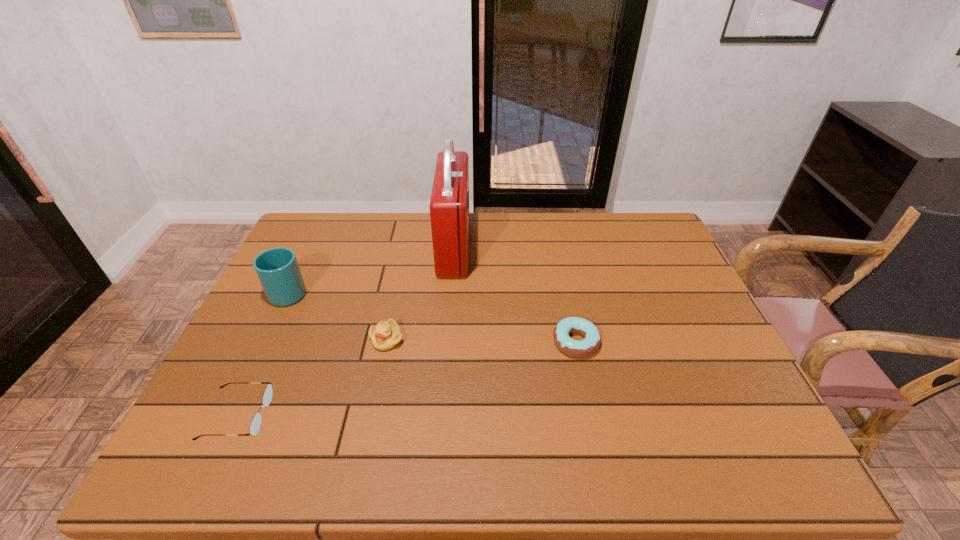
I want to click on vacant area that lies between the doughnut and the spectacles, so click(x=407, y=379).

At what (x,y) coordinates should I click in order to perform the action: click on vacant space that's between the doughnut and the fourth shortest object. Please return your answer as a coordinate pair (x, y). The height and width of the screenshot is (540, 960). Looking at the image, I should click on (433, 316).

You are a GUI agent. You are given a task and a screenshot of the screen. Output one action in this format:
    pyautogui.click(x=<x>, y=<y>)
    Task: Click on the vacant space in between the second tallest object and the spectacles
    This screenshot has width=960, height=540.
    Given the screenshot: What is the action you would take?
    pyautogui.click(x=264, y=353)

The image size is (960, 540). Find the location of `the second closest object to the third shortest object`. the second closest object to the third shortest object is located at coordinates (255, 424).

You are a GUI agent. You are given a task and a screenshot of the screen. Output one action in this format:
    pyautogui.click(x=<x>, y=<y>)
    Task: Click on the object that is the closest to the spectacles
    The height and width of the screenshot is (540, 960).
    Given the screenshot: What is the action you would take?
    pyautogui.click(x=386, y=335)

The image size is (960, 540). Identify the location of vacant position in the image that satisfies the following two spatial constraints: 1. at the face of the duckling; 2. on the lenses of the spectacles. (371, 415).

The height and width of the screenshot is (540, 960). What are the coordinates of `vacant space that satisfies the following two spatial constraints: 1. on the front face of the second object from right to left; 2. on the back side of the rightmost object` in the screenshot? It's located at click(446, 342).

The width and height of the screenshot is (960, 540). I want to click on vacant region that satisfies the following two spatial constraints: 1. on the front face of the first-aid kit; 2. at the face of the duckling, so click(447, 339).

Where is `vacant point that satisfies the following two spatial constraints: 1. on the front face of the tallest object; 2. on the left side of the rightmost object`? vacant point that satisfies the following two spatial constraints: 1. on the front face of the tallest object; 2. on the left side of the rightmost object is located at coordinates (446, 342).

You are a GUI agent. You are given a task and a screenshot of the screen. Output one action in this format:
    pyautogui.click(x=<x>, y=<y>)
    Task: Click on the vacant position in the image that satisfies the following two spatial constraints: 1. at the face of the third tallest object; 2. on the left side of the doughnut
    This screenshot has height=540, width=960.
    Given the screenshot: What is the action you would take?
    pyautogui.click(x=386, y=342)